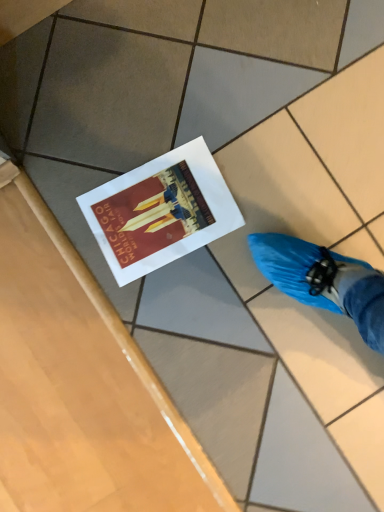
Identify the location of free space above matte paper postcard at center (from a real-world perspective). (163, 211).